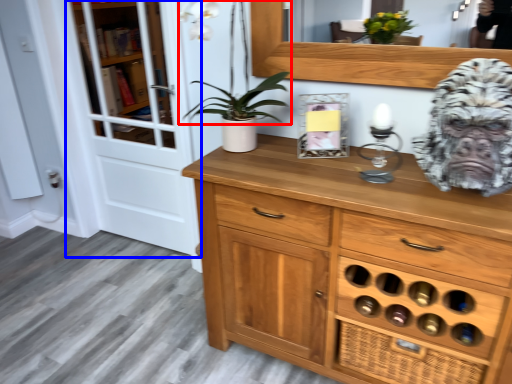
Question: Which object appears closest to the camera in this image, plant (highlighted by a red box) or screen door (highlighted by a blue box)?

Choices:
 (A) plant
 (B) screen door

Answer: (A)